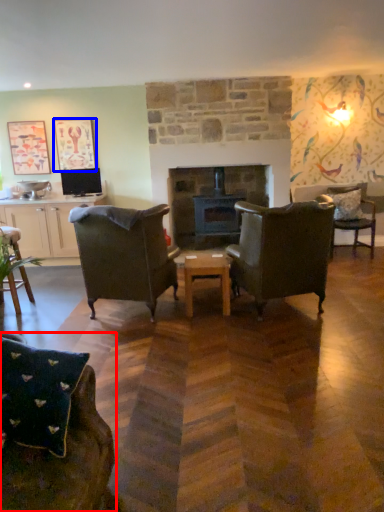
Question: Which of the following is the closest to the observer, chair (highlighted by a red box) or picture frame (highlighted by a blue box)?

Choices:
 (A) chair
 (B) picture frame

Answer: (A)